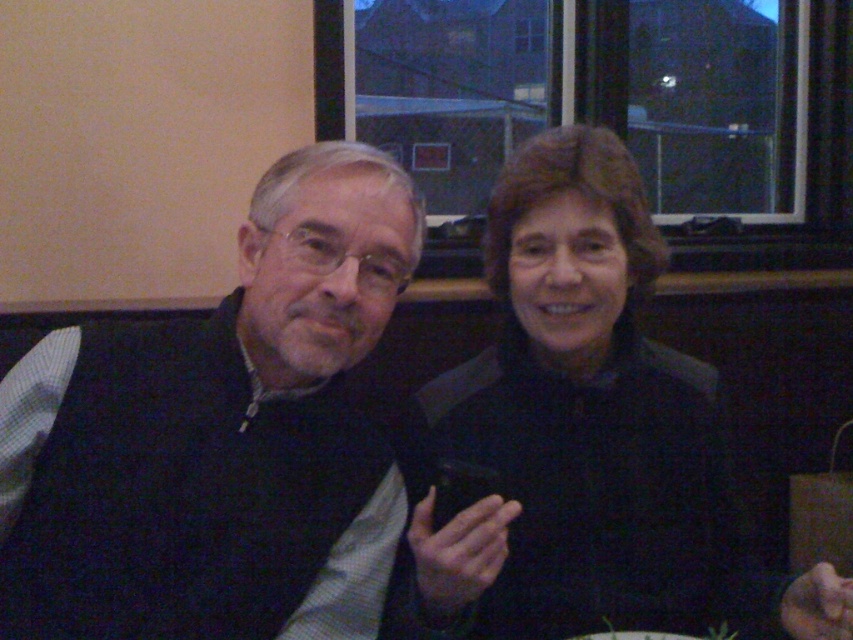
Question: Can you confirm if dark blue sweater at left is positioned below black matte jacket at center?

Choices:
 (A) yes
 (B) no

Answer: (A)

Question: In this image, where is dark blue sweater at left located relative to black matte jacket at center?

Choices:
 (A) right
 (B) left

Answer: (B)

Question: Which point is farther from the camera taking this photo?

Choices:
 (A) (642, 584)
 (B) (310, 284)

Answer: (A)

Question: Is dark blue sweater at left in front of black matte jacket at center?

Choices:
 (A) no
 (B) yes

Answer: (A)

Question: Which point appears farthest from the camera in this image?

Choices:
 (A) (207, 513)
 (B) (619, 518)

Answer: (B)